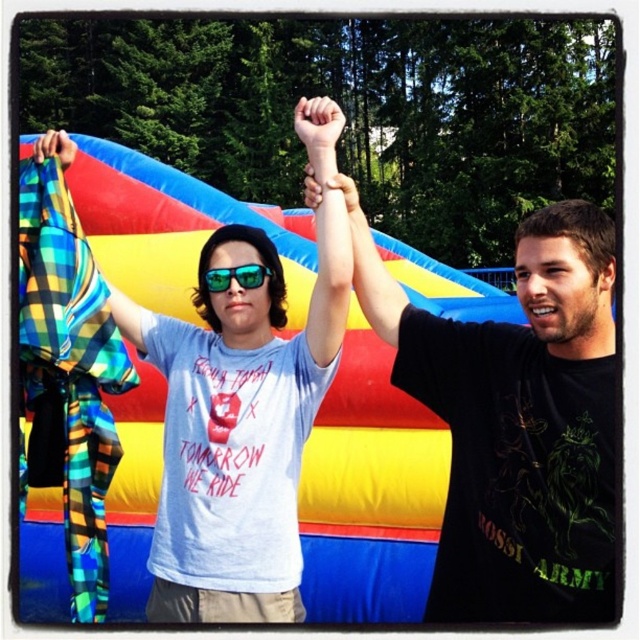
Which is behind, point (241, 273) or point (339, 188)?

Point (241, 273)

Describe the element at coordinates (234, 276) in the screenshot. I see `green reflective sunglasses at center` at that location.

Image resolution: width=640 pixels, height=640 pixels. Find the location of `green reflective sunglasses at center`. green reflective sunglasses at center is located at coordinates (234, 276).

Is matte black arm at center bigger than matte black hand at center?

No, matte black arm at center is not bigger than matte black hand at center.

Does point (332, 138) come closer to viewer compared to point (349, 211)?

That is True.

Between point (324, 220) and point (342, 195), which one is positioned in front?

Positioned in front is point (324, 220).

Where is `matte black arm at center`? matte black arm at center is located at coordinates (326, 228).

Does point (113, 292) come in front of point (339, 132)?

No, it is not.

Between light blue t-shirt at center and smooth skin hand at center, which one is positioned higher?

smooth skin hand at center is higher up.

Which is in front, point (248, 333) or point (317, 116)?

Positioned in front is point (317, 116).

Identify the location of light blue t-shirt at center. The image size is (640, 640). (241, 422).